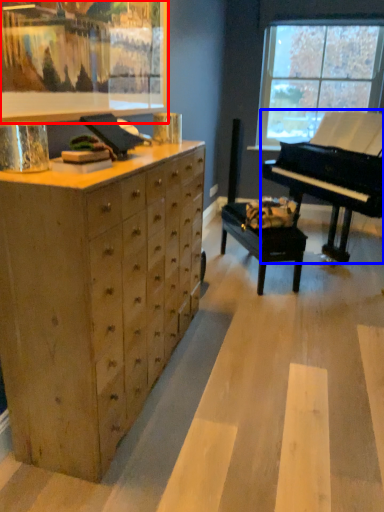
Question: Which object appears farthest to the camera in this image, picture frame (highlighted by a red box) or piano (highlighted by a blue box)?

Choices:
 (A) picture frame
 (B) piano

Answer: (B)